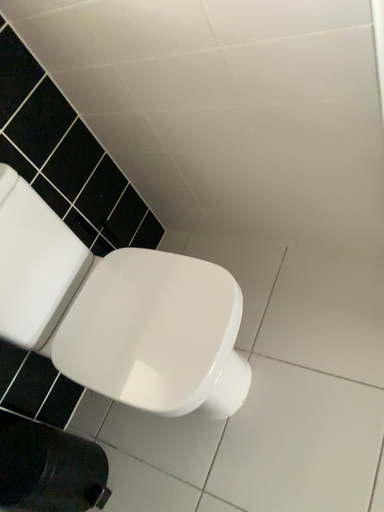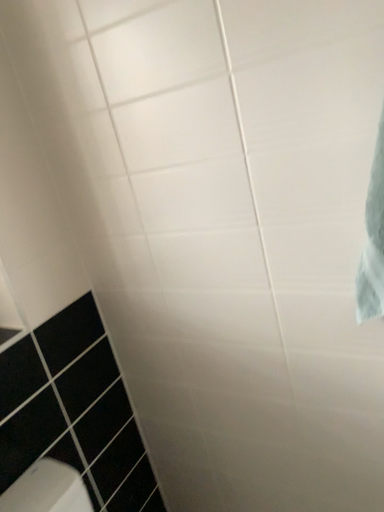
Question: How did the camera likely rotate when shooting the video?

Choices:
 (A) rotated upward
 (B) rotated downward

Answer: (A)